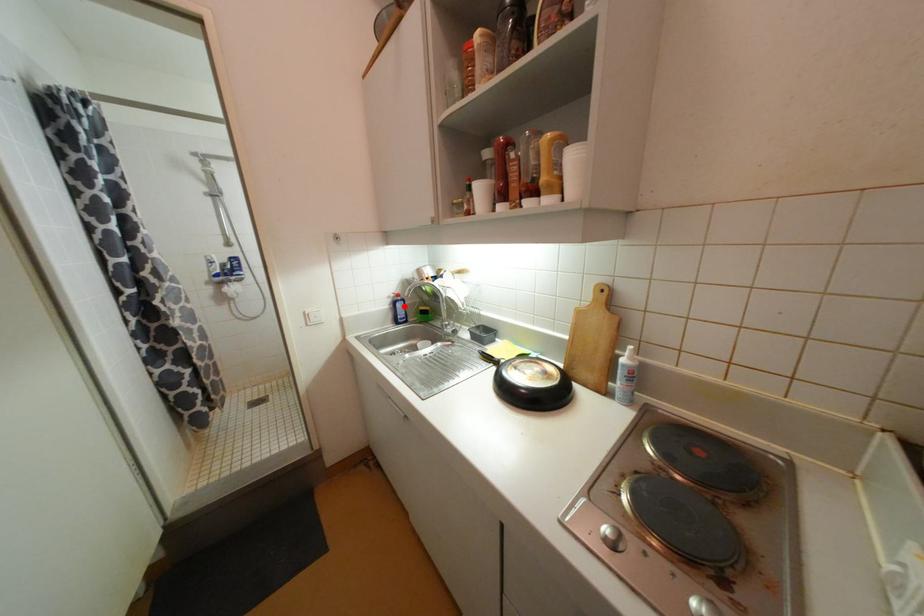
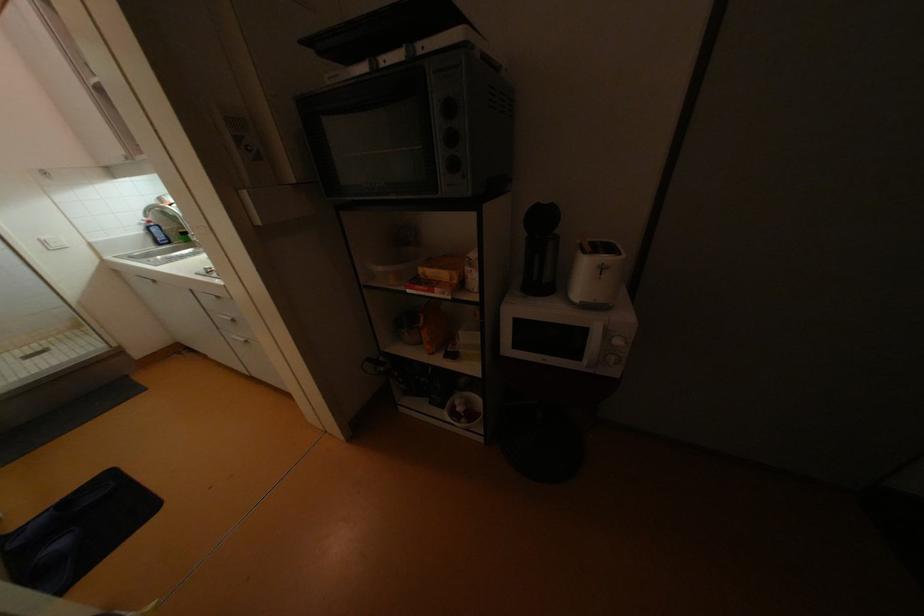
Find the pixel in the second image that matches the highlighted location in the first image.

(160, 231)